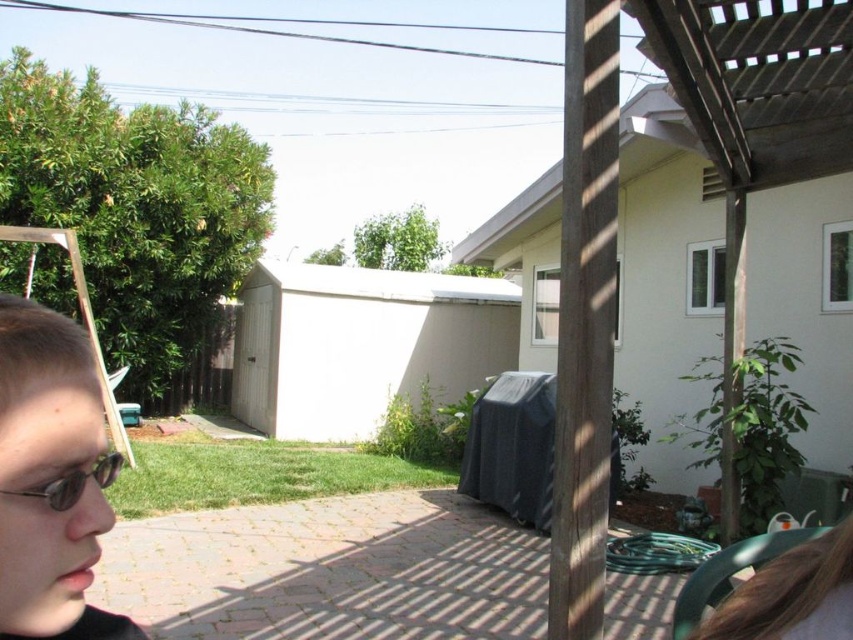
Who is higher up, light brown hair at lower left or blonde hair at lower right?

light brown hair at lower left is above.

Is point (111, 614) behind point (825, 552)?

No, (111, 614) is in front of (825, 552).

You are a GUI agent. You are given a task and a screenshot of the screen. Output one action in this format:
    pyautogui.click(x=<x>, y=<y>)
    Task: Click on the light brown hair at lower left
    The width and height of the screenshot is (853, 640).
    Given the screenshot: What is the action you would take?
    pyautogui.click(x=51, y=477)

Identify the location of light brown hair at lower left. The height and width of the screenshot is (640, 853). (51, 477).

Is point (54, 316) positioned after point (77, 483)?

Yes.

Who is positioned more to the left, light brown hair at lower left or matte black goggles at lower left?

matte black goggles at lower left

This screenshot has width=853, height=640. I want to click on light brown hair at lower left, so click(51, 477).

Can you confirm if blonde hair at lower right is smaller than matte black goggles at lower left?

Yes, blonde hair at lower right is smaller than matte black goggles at lower left.

Can you confirm if blonde hair at lower right is positioned to the right of matte black goggles at lower left?

Yes, blonde hair at lower right is to the right of matte black goggles at lower left.

What do you see at coordinates (792, 595) in the screenshot? I see `blonde hair at lower right` at bounding box center [792, 595].

What are the coordinates of `blonde hair at lower right` in the screenshot? It's located at (792, 595).